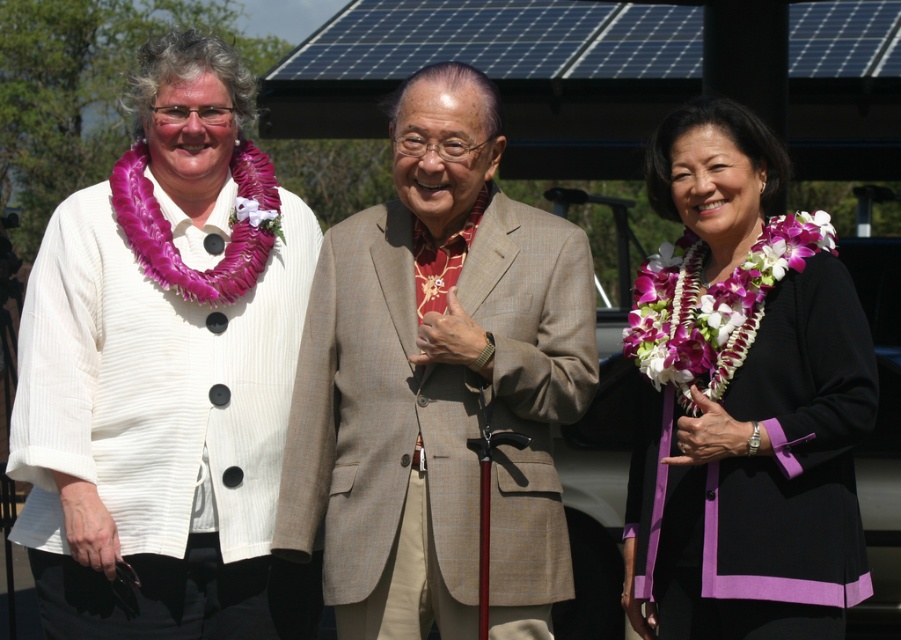
Question: Observing the image, what is the correct spatial positioning of tan textured suit at center in reference to black satin blazer at center?

Choices:
 (A) right
 (B) left

Answer: (B)

Question: Is white textured cardigan at left above tan textured suit at center?

Choices:
 (A) yes
 (B) no

Answer: (A)

Question: Which object is the farthest from the tan textured suit at center?

Choices:
 (A) black satin blazer at center
 (B) white textured cardigan at left

Answer: (B)

Question: Which object is farther from the camera taking this photo?

Choices:
 (A) white textured cardigan at left
 (B) black satin blazer at center
 (C) tan textured suit at center

Answer: (A)

Question: Among these points, which one is farthest from the camera?

Choices:
 (A) (512, 544)
 (B) (114, 634)
 (C) (697, 529)

Answer: (B)

Question: From the image, what is the correct spatial relationship of white textured cardigan at left in relation to black satin blazer at center?

Choices:
 (A) left
 (B) right

Answer: (A)